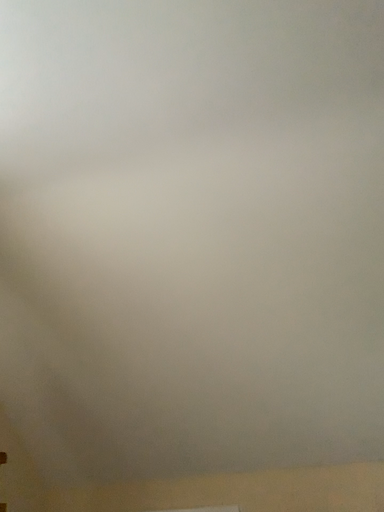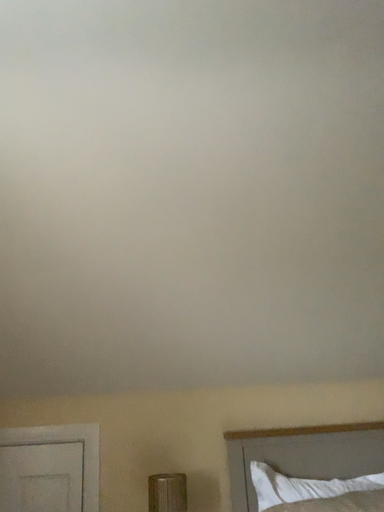
Question: How did the camera likely rotate when shooting the video?

Choices:
 (A) rotated downward
 (B) rotated upward

Answer: (A)